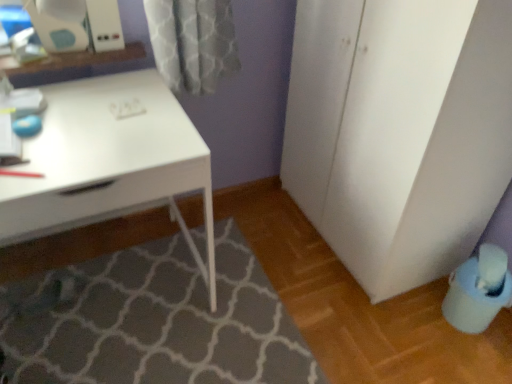
This screenshot has width=512, height=384. Find the location of `blank space to the left of white matte cabinet at right`. blank space to the left of white matte cabinet at right is located at coordinates (267, 226).